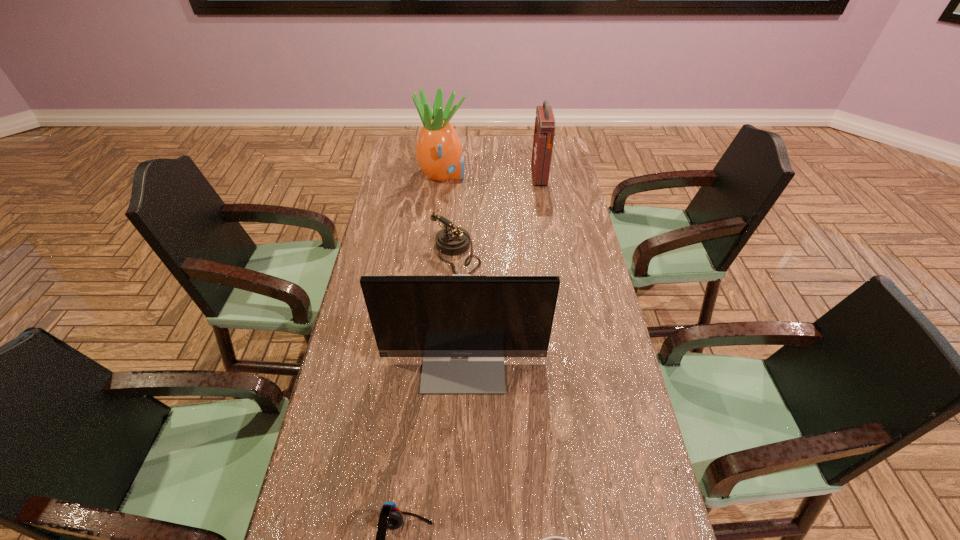
The height and width of the screenshot is (540, 960). I want to click on pineapple, so click(439, 154).

Image resolution: width=960 pixels, height=540 pixels. What are the coordinates of `the rightmost object` in the screenshot? It's located at (544, 130).

What are the coordinates of `computer monitor` in the screenshot? It's located at (463, 326).

Find the location of `telephone`. telephone is located at coordinates (452, 240).

Where is `free space located at the entrance of the pineapple`? The image size is (960, 540). free space located at the entrance of the pineapple is located at coordinates (527, 175).

This screenshot has width=960, height=540. In order to click on free region located 0.160m on the front-facing side of the first-aid kit in this screenshot , I will do `click(495, 178)`.

Find the location of a particular element. vacant region located 0.210m on the front-facing side of the first-aid kit is located at coordinates (485, 178).

You are a GUI agent. You are given a task and a screenshot of the screen. Output one action in this format:
    pyautogui.click(x=<x>, y=<y>)
    Task: Click on the free point located on the front-facing side of the first-aid kit
    The width and height of the screenshot is (960, 540).
    Given the screenshot: What is the action you would take?
    pyautogui.click(x=480, y=178)

What are the coordinates of `vacant position located on the screen of the computer monitor` in the screenshot? It's located at (462, 418).

This screenshot has height=540, width=960. In order to click on free space located on the right of the telephone in this screenshot , I will do `click(534, 254)`.